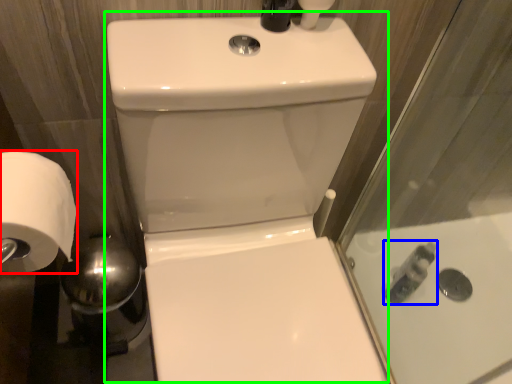
Question: Which object is the closest to the toilet paper (highlighted by a red box)? Choose among these: toiletry (highlighted by a blue box) or sink (highlighted by a green box).

Choices:
 (A) toiletry
 (B) sink

Answer: (B)